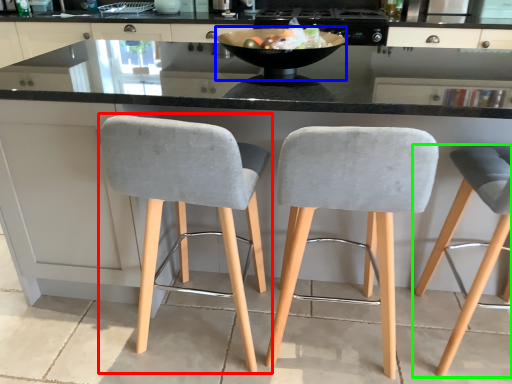
Question: Which is nearer to the chair (highlighted by a red box)? bowl (highlighted by a blue box) or chair (highlighted by a green box).

Choices:
 (A) bowl
 (B) chair

Answer: (A)